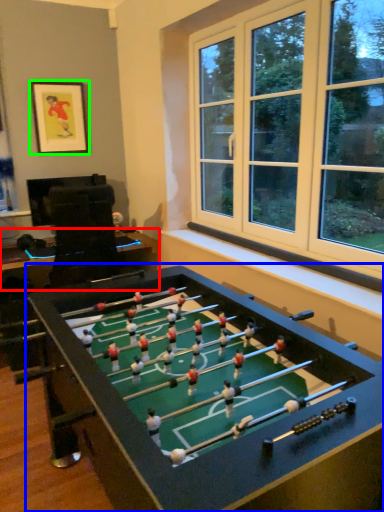
Question: Estimate the real-world distances between objects in this image. Which object is closer to table (highlighted by a red box), table (highlighted by a blue box) or picture frame (highlighted by a green box)?

Choices:
 (A) table
 (B) picture frame

Answer: (B)